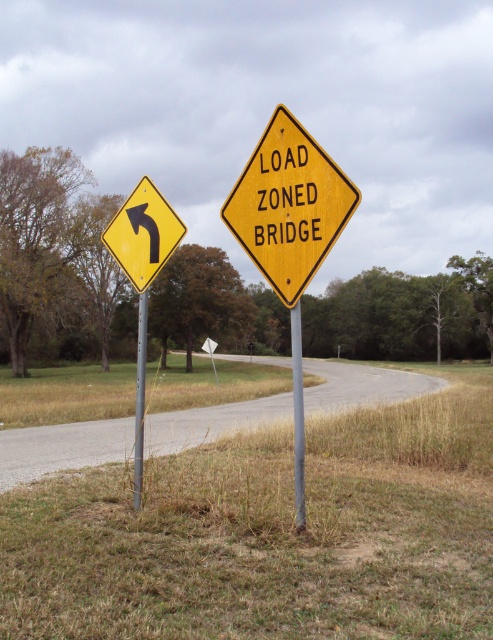
Is yellow matte arrow at left to the left of metallic gray pole at center from the viewer's perspective?

Correct, you'll find yellow matte arrow at left to the left of metallic gray pole at center.

Who is more forward, (150, 275) or (300, 413)?

Point (300, 413) is in front.

Which is behind, point (137, 188) or point (297, 321)?

Positioned behind is point (137, 188).

I want to click on yellow matte arrow at left, so click(142, 234).

Is yellow diamond-shaped sign at center in front of metallic gray pole at center?

Yes, it is in front of metallic gray pole at center.

Can you confirm if yellow diamond-shaped sign at center is taller than metallic gray pole at center?

No.

Is point (289, 220) closer to camera compared to point (294, 484)?

Yes.

Where is `yellow diamond-shaped sign at center`? This screenshot has width=493, height=640. yellow diamond-shaped sign at center is located at coordinates (288, 205).

Does yellow diamond-shaped sign at center appear over yellow matte arrow at left?

No.

What do you see at coordinates (288, 205) in the screenshot?
I see `yellow diamond-shaped sign at center` at bounding box center [288, 205].

I want to click on yellow diamond-shaped sign at center, so click(288, 205).